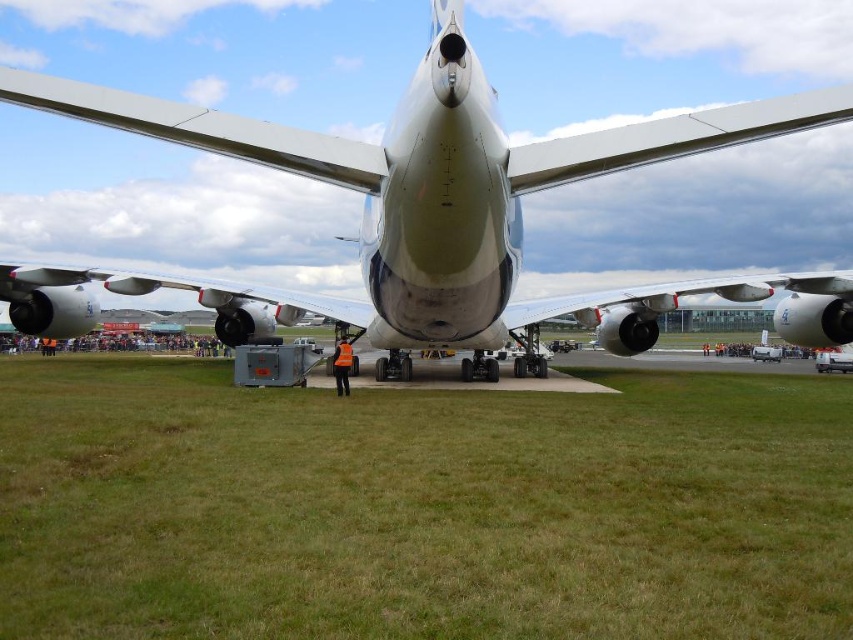
You are a maintenance worker standing on the paved area near the aircraft. You need to walk from the aircraft to the green grass at center. How many steps would you need to take if each step covers approximately 0.7 meters?

The distance between the aircraft and the green grass at center is 2.26 meters. Each step covers 0.7 meters, so dividing 2.26 by 0.7 gives approximately 3.23 steps. Since you can only take whole steps, you would need to take 4 steps to reach the green grass at center.

You are standing on the airfield and see the green grass at center and the metallic silver airplane at center. Which object is located more to the left?

The green grass at center is positioned on the left side of the metallic silver airplane at center, so it is more to the left.